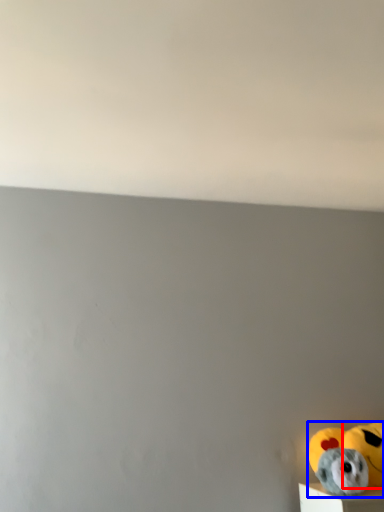
Question: Which object is further to the camera taking this photo, stuffed animal (highlighted by a red box) or toy (highlighted by a blue box)?

Choices:
 (A) stuffed animal
 (B) toy

Answer: (A)